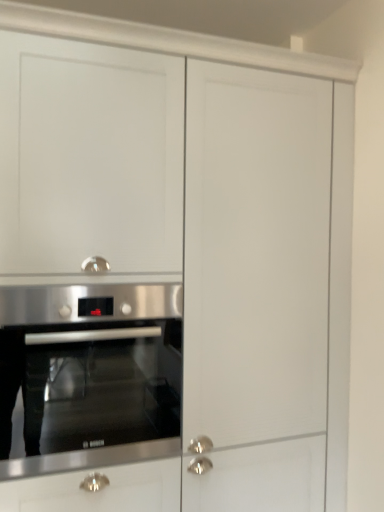
This screenshot has height=512, width=384. Find the location of `stainless steel oven at lower left`. stainless steel oven at lower left is located at coordinates (88, 375).

In order to face stainless steel oven at lower left, should I rotate leftwards or rightwards?

Rotate left and turn 13.491 degrees.

What do you see at coordinates (88, 375) in the screenshot? I see `stainless steel oven at lower left` at bounding box center [88, 375].

Locate an element on the screen. This screenshot has width=384, height=512. stainless steel oven at lower left is located at coordinates (88, 375).